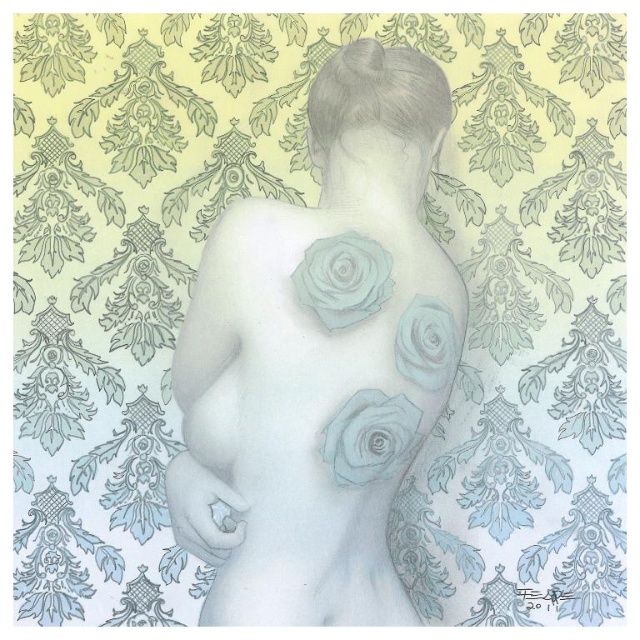
Question: Based on their relative distances, which object is nearer to the light blue pastel rose at upper center?

Choices:
 (A) matte blue rose at upper right
 (B) matte gray rose at center
 (C) light blue paper rose at center

Answer: (A)

Question: Can you confirm if light blue pastel rose at upper center is smaller than matte blue rose at upper right?

Choices:
 (A) no
 (B) yes

Answer: (B)

Question: Is light blue pastel rose at upper center further to the viewer compared to matte gray rose at center?

Choices:
 (A) yes
 (B) no

Answer: (A)

Question: Considering the real-world distances, which object is closest to the matte blue rose at upper right?

Choices:
 (A) light blue pastel rose at upper center
 (B) matte gray rose at center

Answer: (B)

Question: Which object is closer to the camera taking this photo?

Choices:
 (A) light blue pastel rose at upper center
 (B) matte gray rose at center
 (C) matte blue rose at upper right

Answer: (B)

Question: Does light blue paper rose at center have a lesser width compared to matte gray rose at center?

Choices:
 (A) yes
 (B) no

Answer: (B)